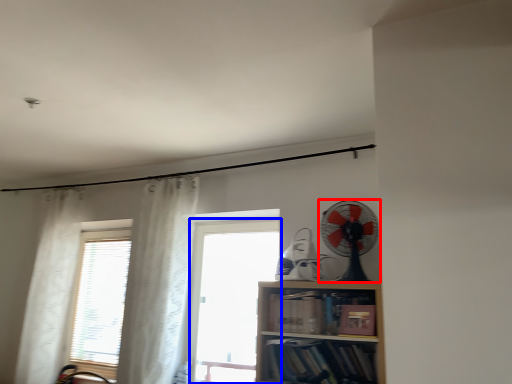
Question: Which of the following is the farthest to the observer, mechanical fan (highlighted by a red box) or window (highlighted by a blue box)?

Choices:
 (A) mechanical fan
 (B) window

Answer: (B)